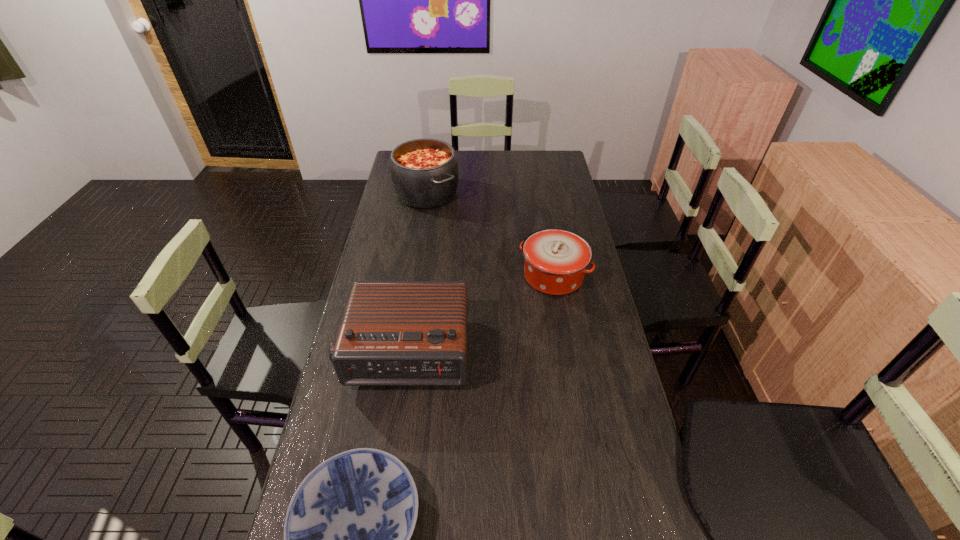
Find the location of `vacant area between the second shortest object and the third farthest object`. vacant area between the second shortest object and the third farthest object is located at coordinates (480, 314).

At what (x,y) coordinates should I click in order to perform the action: click on the closest object relative to the left casserole. Please return your answer as a coordinate pair (x, y). Looking at the image, I should click on (556, 259).

The image size is (960, 540). In order to click on object that is the second closest to the plate in this screenshot , I will do `click(556, 259)`.

At what (x,y) coordinates should I click in order to perform the action: click on free location that satisfies the following two spatial constraints: 1. on the front side of the taller casserole; 2. on the left side of the shorter casserole. Please return your answer as a coordinate pair (x, y). Looking at the image, I should click on (414, 276).